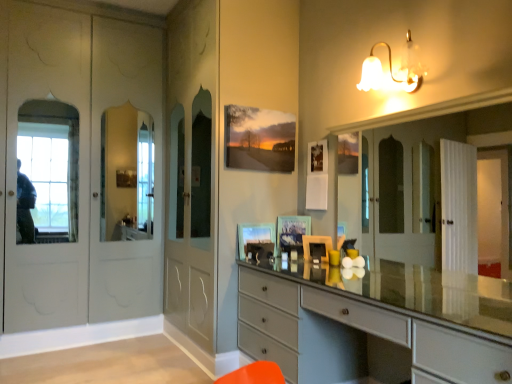
What do you see at coordinates (392, 70) in the screenshot? The width and height of the screenshot is (512, 384). I see `white glass bell-shaped light fixture at upper right` at bounding box center [392, 70].

Describe the element at coordinates (375, 331) in the screenshot. This screenshot has width=512, height=384. I see `matte gray chest of drawers at center` at that location.

Where is `matte glass picture frame at center, which is counted as the first picture frame, starting from the right`? This screenshot has width=512, height=384. matte glass picture frame at center, which is counted as the first picture frame, starting from the right is located at coordinates (292, 232).

Considering the relative sizes of white glass bell-shaped light fixture at upper right and matte glass picture frame at center, which is counted as the first picture frame, starting from the right, in the image provided, is white glass bell-shaped light fixture at upper right shorter than matte glass picture frame at center, which is counted as the first picture frame, starting from the right,?

Correct, white glass bell-shaped light fixture at upper right is not as tall as matte glass picture frame at center, which is counted as the first picture frame, starting from the right.

Does white glass bell-shaped light fixture at upper right have a larger size compared to matte glass picture frame at center, marked as the 2th picture frame in a left-to-right arrangement?

Indeed, white glass bell-shaped light fixture at upper right has a larger size compared to matte glass picture frame at center, marked as the 2th picture frame in a left-to-right arrangement.

From a real-world perspective, is white glass bell-shaped light fixture at upper right above or below matte glass picture frame at center, marked as the 2th picture frame in a left-to-right arrangement?

From a real-world perspective, white glass bell-shaped light fixture at upper right is physically above matte glass picture frame at center, marked as the 2th picture frame in a left-to-right arrangement.

Considering the relative positions of matte gray chest of drawers at center and white glass bell-shaped light fixture at upper right in the image provided, is matte gray chest of drawers at center behind white glass bell-shaped light fixture at upper right?

No.

Locate an element on the screen. The width and height of the screenshot is (512, 384). light fixture on the right of matte gray chest of drawers at center is located at coordinates (392, 70).

From the image's perspective, which object appears higher, matte gray chest of drawers at center or white glass bell-shaped light fixture at upper right?

white glass bell-shaped light fixture at upper right.

Is white glass bell-shaped light fixture at upper right at the back of matte gray chest of drawers at center?

No, white glass bell-shaped light fixture at upper right is not at the back of matte gray chest of drawers at center.

From a real-world perspective, does matte gray chest of drawers at center sit lower than matte glass picture frame at center, which is the 2th picture frame from right to left?

Yes.

Which point is more distant from viewer, (364, 306) or (246, 255)?

Positioned behind is point (246, 255).

Image resolution: width=512 pixels, height=384 pixels. What are the coordinates of `the chest of drawers beneath the matte glass picture frame at center, the 1th picture frame from the left (from a real-world perspective)` in the screenshot? It's located at (375, 331).

Which object is further away from the camera, matte gray chest of drawers at center or matte glass picture frame at center, the 1th picture frame from the left?

matte glass picture frame at center, the 1th picture frame from the left, is further from the camera.

From the image's perspective, is matte glass picture frame at center, marked as the 2th picture frame in a left-to-right arrangement, positioned above or below white glass bell-shaped light fixture at upper right?

From the image's perspective, matte glass picture frame at center, marked as the 2th picture frame in a left-to-right arrangement, appears below white glass bell-shaped light fixture at upper right.

Based on the photo, does matte glass picture frame at center, marked as the 2th picture frame in a left-to-right arrangement, have a lesser height compared to white glass bell-shaped light fixture at upper right?

In fact, matte glass picture frame at center, marked as the 2th picture frame in a left-to-right arrangement, may be taller than white glass bell-shaped light fixture at upper right.

Looking at the image, does matte glass picture frame at center, which is counted as the first picture frame, starting from the right, seem bigger or smaller compared to white glass bell-shaped light fixture at upper right?

Considering their sizes, matte glass picture frame at center, which is counted as the first picture frame, starting from the right, takes up less space than white glass bell-shaped light fixture at upper right.

Which object is closer to the camera, matte glass picture frame at center, marked as the 2th picture frame in a left-to-right arrangement, or white glass bell-shaped light fixture at upper right?

white glass bell-shaped light fixture at upper right is closer to the camera.

From the image's perspective, between white glass bell-shaped light fixture at upper right and matte glass picture frame at center, which is the 2th picture frame from right to left, which one is located above?

white glass bell-shaped light fixture at upper right, from the image's perspective.

Between white glass bell-shaped light fixture at upper right and matte glass picture frame at center, which is the 2th picture frame from right to left, which one has larger width?

white glass bell-shaped light fixture at upper right is wider.

Does white glass bell-shaped light fixture at upper right have a greater height compared to matte glass picture frame at center, the 1th picture frame from the left?

Correct, white glass bell-shaped light fixture at upper right is much taller as matte glass picture frame at center, the 1th picture frame from the left.

Is matte glass picture frame at center, the 1th picture frame from the left, not inside matte glass picture frame at center, which is counted as the first picture frame, starting from the right?

Indeed, matte glass picture frame at center, the 1th picture frame from the left, is completely outside matte glass picture frame at center, which is counted as the first picture frame, starting from the right.

Consider the image. From a real-world perspective, is matte glass picture frame at center, the 1th picture frame from the left, over matte glass picture frame at center, which is counted as the first picture frame, starting from the right?

No, from a real-world perspective, matte glass picture frame at center, the 1th picture frame from the left, is not above matte glass picture frame at center, which is counted as the first picture frame, starting from the right.

This screenshot has width=512, height=384. What are the coordinates of `picture frame above the matte glass picture frame at center, the 1th picture frame from the left (from a real-world perspective)` in the screenshot? It's located at (292, 232).

From their relative heights in the image, would you say matte glass picture frame at center, the 1th picture frame from the left, is taller or shorter than matte glass picture frame at center, which is counted as the first picture frame, starting from the right?

matte glass picture frame at center, the 1th picture frame from the left, is shorter than matte glass picture frame at center, which is counted as the first picture frame, starting from the right.

Which is closer, (372, 302) or (291, 232)?

The point (372, 302) is more forward.

From the image's perspective, which is below, matte gray chest of drawers at center or matte glass picture frame at center, marked as the 2th picture frame in a left-to-right arrangement?

matte gray chest of drawers at center is shown below in the image.

Is matte gray chest of drawers at center facing towards matte glass picture frame at center, which is counted as the first picture frame, starting from the right?

No, matte gray chest of drawers at center does not turn towards matte glass picture frame at center, which is counted as the first picture frame, starting from the right.

Does matte gray chest of drawers at center have a lesser width compared to matte glass picture frame at center, marked as the 2th picture frame in a left-to-right arrangement?

Incorrect, the width of matte gray chest of drawers at center is not less than that of matte glass picture frame at center, marked as the 2th picture frame in a left-to-right arrangement.

Locate an element on the screen. The width and height of the screenshot is (512, 384). light fixture that is above the matte glass picture frame at center, marked as the 2th picture frame in a left-to-right arrangement (from the image's perspective) is located at coordinates (392, 70).

This screenshot has width=512, height=384. I want to click on light fixture above the matte gray chest of drawers at center (from a real-world perspective), so click(x=392, y=70).

Which object lies nearer to the anchor point matte gray chest of drawers at center, white glass bell-shaped light fixture at upper right or matte glass picture frame at center, marked as the 2th picture frame in a left-to-right arrangement?

matte glass picture frame at center, marked as the 2th picture frame in a left-to-right arrangement.

Which object lies nearer to the anchor point matte glass picture frame at center, which is counted as the first picture frame, starting from the right, matte gray chest of drawers at center or white glass bell-shaped light fixture at upper right?

matte gray chest of drawers at center is positioned closer to the anchor matte glass picture frame at center, which is counted as the first picture frame, starting from the right.

Considering their positions, is matte glass picture frame at center, which is the 2th picture frame from right to left, positioned further to matte gray chest of drawers at center than white glass bell-shaped light fixture at upper right?

white glass bell-shaped light fixture at upper right is positioned further to the anchor matte gray chest of drawers at center.

Based on their spatial positions, is matte glass picture frame at center, marked as the 2th picture frame in a left-to-right arrangement, or matte glass picture frame at center, the 1th picture frame from the left, further from white glass bell-shaped light fixture at upper right?

Based on the image, matte glass picture frame at center, the 1th picture frame from the left, appears to be further to white glass bell-shaped light fixture at upper right.

Considering their positions, is matte glass picture frame at center, the 1th picture frame from the left, positioned closer to matte glass picture frame at center, marked as the 2th picture frame in a left-to-right arrangement, than white glass bell-shaped light fixture at upper right?

Based on the image, matte glass picture frame at center, the 1th picture frame from the left, appears to be nearer to matte glass picture frame at center, marked as the 2th picture frame in a left-to-right arrangement.

Looking at the image, which one is located further to white glass bell-shaped light fixture at upper right, matte glass picture frame at center, marked as the 2th picture frame in a left-to-right arrangement, or matte gray chest of drawers at center?

matte gray chest of drawers at center lies further to white glass bell-shaped light fixture at upper right than the other object.

Estimate the real-world distances between objects in this image. Which object is closer to matte glass picture frame at center, marked as the 2th picture frame in a left-to-right arrangement, white glass bell-shaped light fixture at upper right or matte gray chest of drawers at center?

The object closer to matte glass picture frame at center, marked as the 2th picture frame in a left-to-right arrangement, is matte gray chest of drawers at center.

Based on their spatial positions, is white glass bell-shaped light fixture at upper right or matte glass picture frame at center, which is the 2th picture frame from right to left, further from matte gray chest of drawers at center?

white glass bell-shaped light fixture at upper right is further to matte gray chest of drawers at center.

Locate an element on the screen. light fixture between matte gray chest of drawers at center and matte glass picture frame at center, the 1th picture frame from the left, in the front-back direction is located at coordinates (392, 70).

Identify the location of picture frame that lies between white glass bell-shaped light fixture at upper right and matte glass picture frame at center, the 1th picture frame from the left, from top to bottom. (292, 232).

The image size is (512, 384). Find the location of `picture frame between matte gray chest of drawers at center and matte glass picture frame at center, which is counted as the first picture frame, starting from the right, along the z-axis`. picture frame between matte gray chest of drawers at center and matte glass picture frame at center, which is counted as the first picture frame, starting from the right, along the z-axis is located at coordinates (256, 240).

Identify the location of light fixture between matte gray chest of drawers at center and matte glass picture frame at center, which is counted as the first picture frame, starting from the right, from front to back. (392, 70).